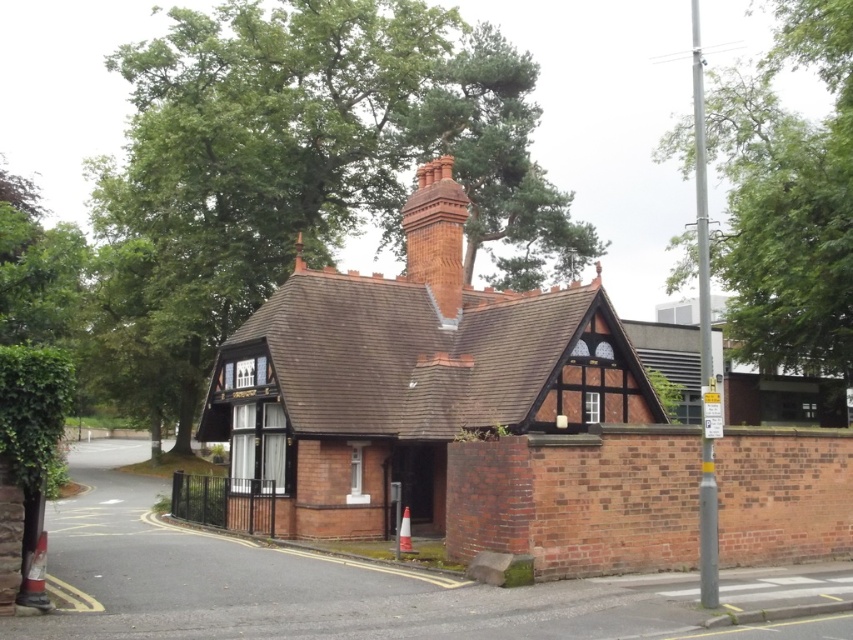
Does green leafy tree at right have a larger size compared to red brick chimney at upper center?

Correct, green leafy tree at right is larger in size than red brick chimney at upper center.

Which is in front, point (773, 188) or point (432, 266)?

Point (432, 266) is more forward.

Is point (851, 112) positioned before point (407, 232)?

That is False.

I want to click on green leafy tree at right, so click(788, 205).

Is green leafy tree at upper center wider than red brick chimney at upper center?

Yes, green leafy tree at upper center is wider than red brick chimney at upper center.

Which is in front, point (164, 243) or point (434, 180)?

Point (434, 180)

Find the location of a particular element. The width and height of the screenshot is (853, 640). green leafy tree at upper center is located at coordinates (300, 168).

Which is in front, point (169, 342) or point (758, 323)?

Point (758, 323) is in front.

Can you confirm if green leafy tree at upper center is positioned to the right of green leafy tree at right?

In fact, green leafy tree at upper center is to the left of green leafy tree at right.

Image resolution: width=853 pixels, height=640 pixels. What do you see at coordinates (300, 168) in the screenshot? I see `green leafy tree at upper center` at bounding box center [300, 168].

You are a GUI agent. You are given a task and a screenshot of the screen. Output one action in this format:
    pyautogui.click(x=<x>, y=<y>)
    Task: Click on the green leafy tree at upper center
    The width and height of the screenshot is (853, 640).
    Given the screenshot: What is the action you would take?
    pyautogui.click(x=300, y=168)